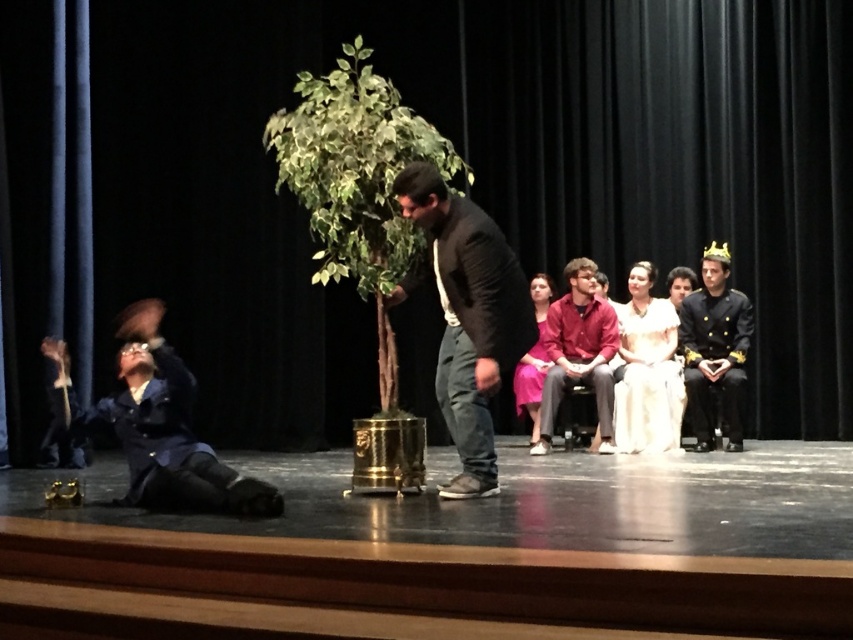
Is green leafy plant at center closer to camera compared to black shiny uniform at right?

That is True.

Which is in front, point (299, 172) or point (706, 308)?

Point (299, 172) is more forward.

I want to click on green leafy plant at center, so click(357, 182).

Can you confirm if dark gray sweater at center is shorter than silky white dress at center?

No, dark gray sweater at center is not shorter than silky white dress at center.

Measure the distance between dark gray sweater at center and camera.

13.13 feet

Is point (457, 257) farther from camera compared to point (663, 401)?

No, (457, 257) is closer to viewer.

You are a GUI agent. You are given a task and a screenshot of the screen. Output one action in this format:
    pyautogui.click(x=<x>, y=<y>)
    Task: Click on the dark gray sweater at center
    The image size is (853, 640).
    Given the screenshot: What is the action you would take?
    pyautogui.click(x=469, y=317)

Is silky white dress at center closer to camera compared to black shiny uniform at right?

No, silky white dress at center is further to the viewer.

Between silky white dress at center and black shiny uniform at right, which one is positioned lower?

Positioned lower is silky white dress at center.

Does point (660, 358) come in front of point (712, 323)?

That is True.

Where is `silky white dress at center`? This screenshot has height=640, width=853. silky white dress at center is located at coordinates (646, 369).